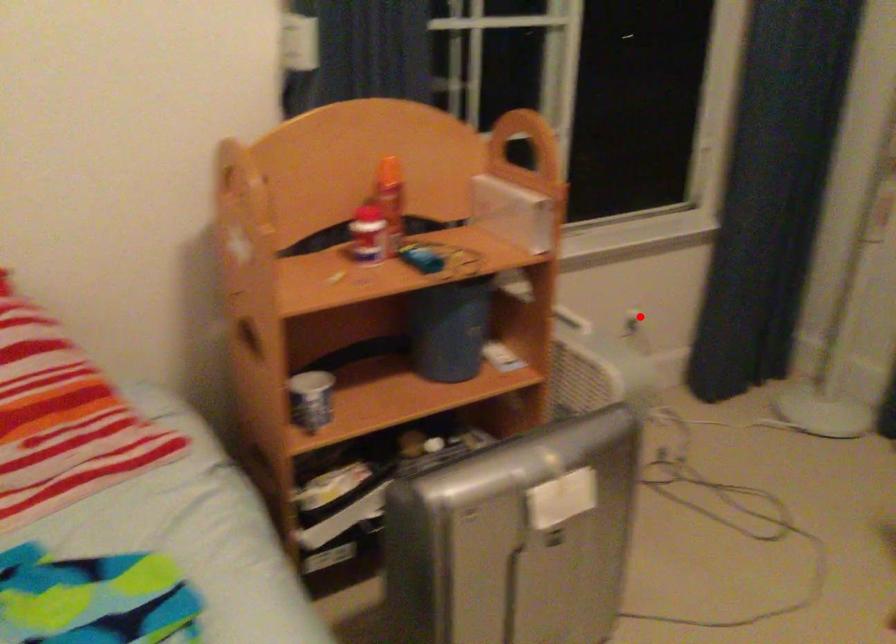
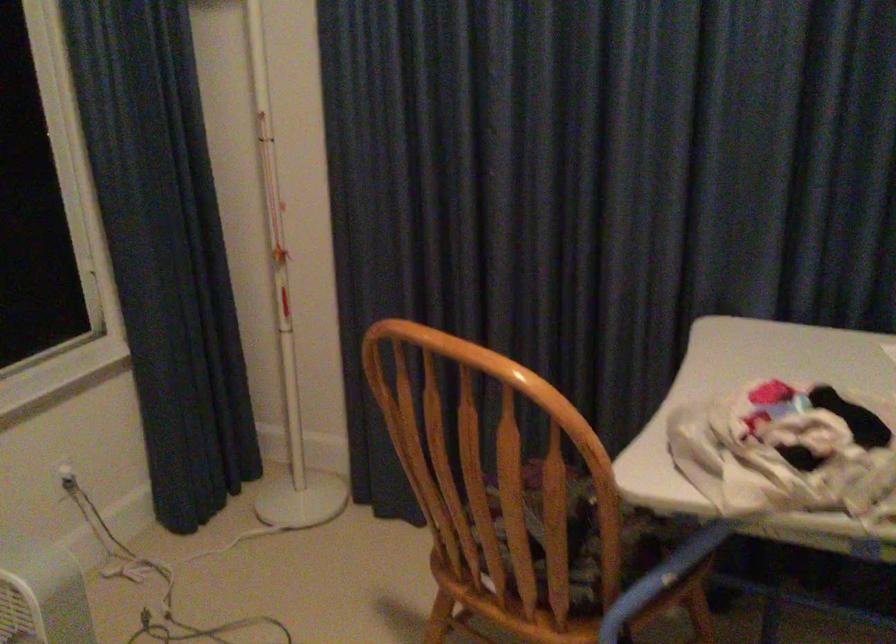
Question: I am providing you with two images of the same scene from different viewpoints. Given a red point in image1, look at the same physical point in image2. Is it:

Choices:
 (A) Closer to the viewpoint
 (B) Farther from the viewpoint

Answer: (A)